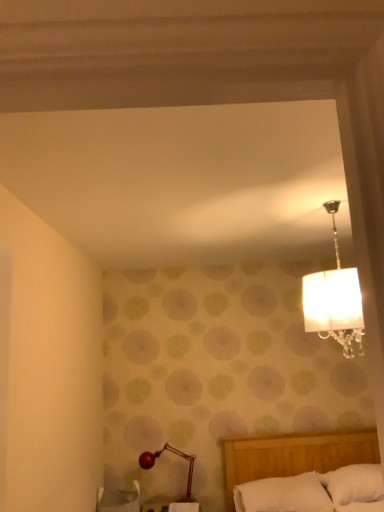
Question: Can you see white soft pillow at lower right, arranged as the 1th pillow when viewed from the right, touching white soft pillow at lower center, the 1th pillow viewed from the left?

Choices:
 (A) yes
 (B) no

Answer: (B)

Question: Considering the relative positions of white soft pillow at lower right, marked as the second pillow in a left-to-right arrangement, and white soft pillow at lower center, the 1th pillow viewed from the left, in the image provided, is white soft pillow at lower right, marked as the second pillow in a left-to-right arrangement, to the right of white soft pillow at lower center, the 1th pillow viewed from the left, from the viewer's perspective?

Choices:
 (A) no
 (B) yes

Answer: (B)

Question: Is white soft pillow at lower right, marked as the second pillow in a left-to-right arrangement, bigger than white soft pillow at lower center, the 1th pillow viewed from the left?

Choices:
 (A) no
 (B) yes

Answer: (A)

Question: Does white soft pillow at lower right, marked as the second pillow in a left-to-right arrangement, turn towards white soft pillow at lower center, which is the 2th pillow from right to left?

Choices:
 (A) yes
 (B) no

Answer: (B)

Question: Is white soft pillow at lower right, marked as the second pillow in a left-to-right arrangement, not inside white soft pillow at lower center, the 1th pillow viewed from the left?

Choices:
 (A) yes
 (B) no

Answer: (A)

Question: Considering the relative sizes of white soft pillow at lower right, arranged as the 1th pillow when viewed from the right, and white soft pillow at lower center, the 1th pillow viewed from the left, in the image provided, is white soft pillow at lower right, arranged as the 1th pillow when viewed from the right, smaller than white soft pillow at lower center, the 1th pillow viewed from the left,?

Choices:
 (A) no
 (B) yes

Answer: (B)

Question: From a real-world perspective, does white woven basket at lower left sit lower than white soft pillow at lower right, marked as the second pillow in a left-to-right arrangement?

Choices:
 (A) yes
 (B) no

Answer: (A)

Question: Is white woven basket at lower left wider than white soft pillow at lower right, marked as the second pillow in a left-to-right arrangement?

Choices:
 (A) yes
 (B) no

Answer: (A)

Question: From the image's perspective, does white woven basket at lower left appear lower than white soft pillow at lower right, marked as the second pillow in a left-to-right arrangement?

Choices:
 (A) yes
 (B) no

Answer: (A)

Question: Is white woven basket at lower left outside of white soft pillow at lower right, arranged as the 1th pillow when viewed from the right?

Choices:
 (A) yes
 (B) no

Answer: (A)

Question: Can you confirm if white woven basket at lower left is positioned to the left of white soft pillow at lower right, marked as the second pillow in a left-to-right arrangement?

Choices:
 (A) no
 (B) yes

Answer: (B)

Question: From the image's perspective, is white woven basket at lower left on top of white soft pillow at lower right, marked as the second pillow in a left-to-right arrangement?

Choices:
 (A) no
 (B) yes

Answer: (A)

Question: Is white woven basket at lower left shorter than shiny red lamp at lower left?

Choices:
 (A) yes
 (B) no

Answer: (A)